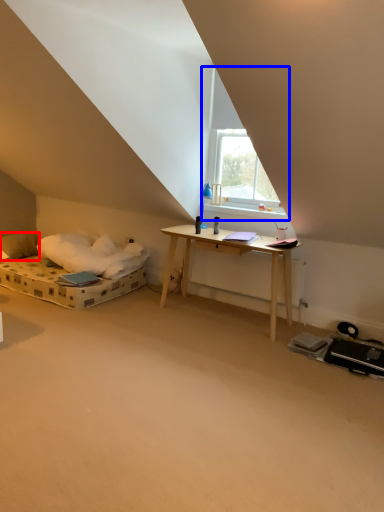
Question: Which object is closer to the camera taking this photo, pillow (highlighted by a red box) or window (highlighted by a blue box)?

Choices:
 (A) pillow
 (B) window

Answer: (B)